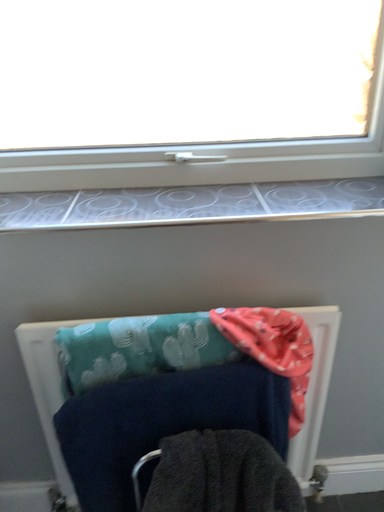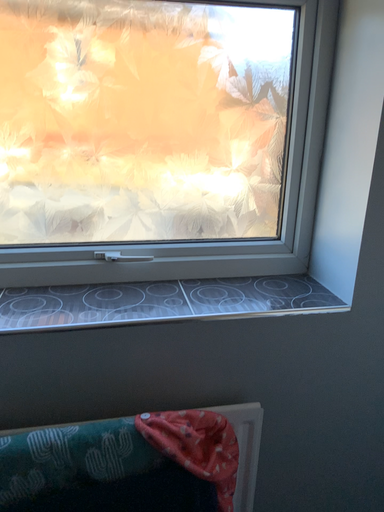
Question: How did the camera likely rotate when shooting the video?

Choices:
 (A) rotated right
 (B) rotated left

Answer: (A)